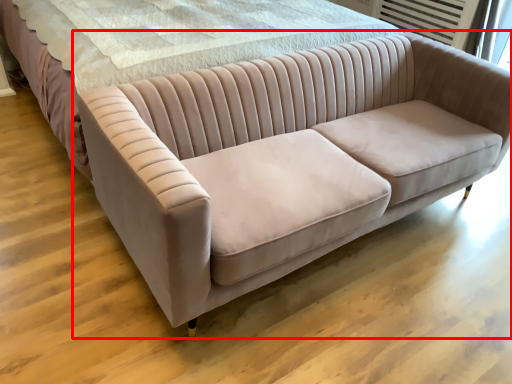
Question: From the image's perspective, considering the relative positions of studio couch (annotated by the red box) and bed in the image provided, where is studio couch (annotated by the red box) located with respect to the staircase?

Choices:
 (A) above
 (B) below

Answer: (B)